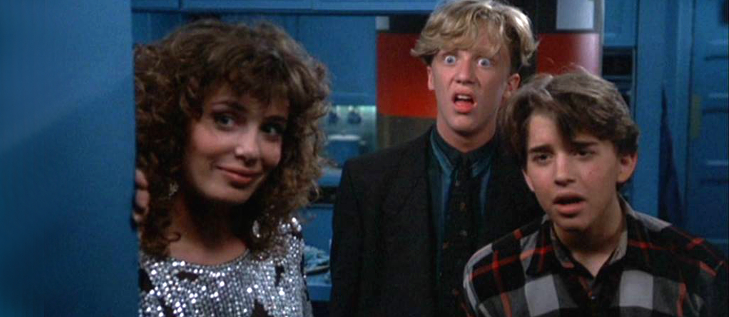
The height and width of the screenshot is (317, 729). Find the location of `orange stripe above refrigerator`. orange stripe above refrigerator is located at coordinates (410, 91).